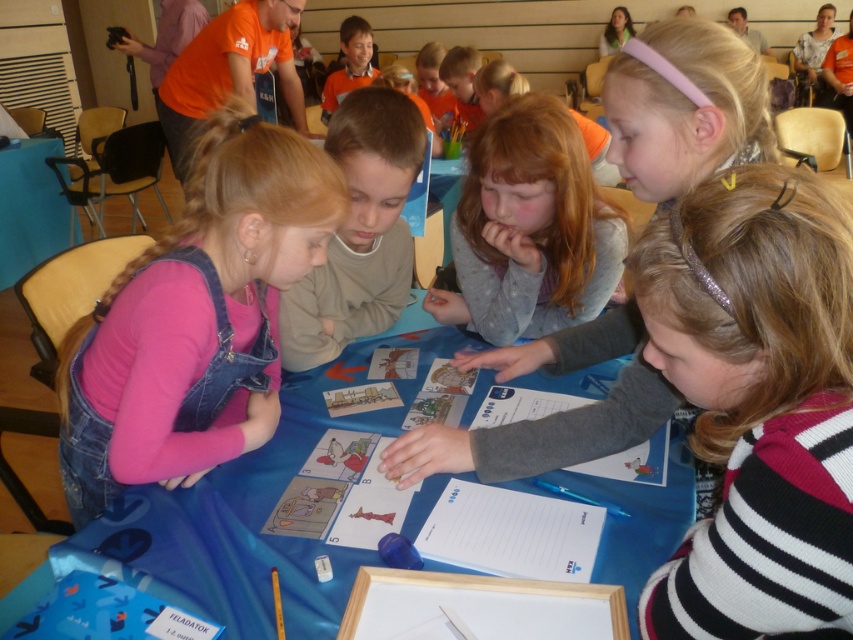
You are a teacher observing the children at the table. You notice the pink denim overalls at left and the matte orange shirt at upper center. Which child is wearing clothing that takes up more visual space in the scene?

The pink denim overalls at left takes up more visual space in the scene because it is larger in size than the matte orange shirt at upper center.

You are a teacher observing the children around the table. You notice two points marked on the blue cloth. The first point is at coordinates point (236, 410) and the second is at point (477, 61). From the childrens perspective sitting around the table, which point is closer to them?

Point (236, 410) is in front of point (477, 61), so from the childrens perspective sitting around the table, the point (236, 410) is closer to them.

You are a teacher observing the children at the table. You notice the light brown sweater at center and the matte orange shirt at upper center. Which child is standing closer to the front of the table?

The light brown sweater at center is much taller than the matte orange shirt at upper center, so the child wearing the light brown sweater at center is standing closer to the front of the table because they are taller and thus their position is more forward.